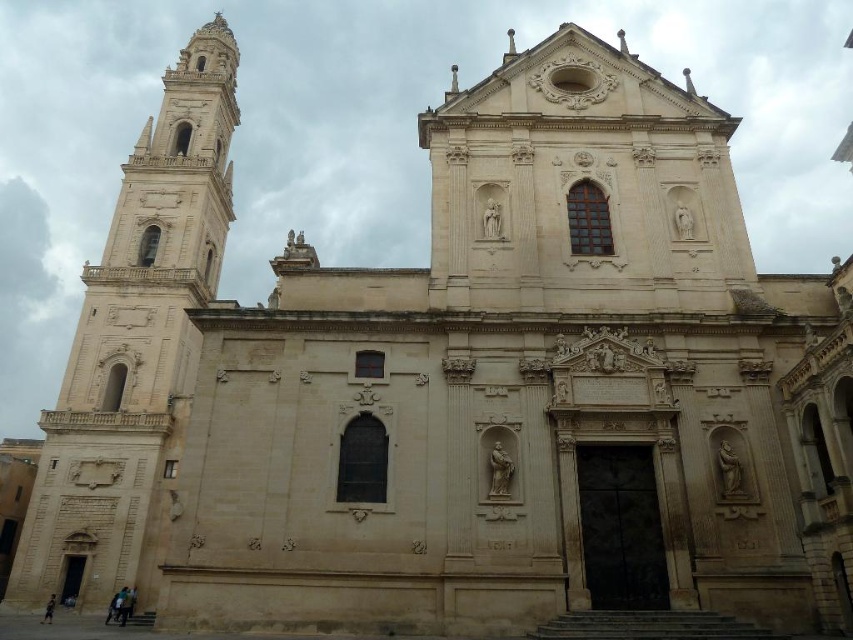
Which is below, smooth beige statue at center or light brown sandal at lower left?

light brown sandal at lower left

Is smooth beige statue at center closer to the viewer compared to light brown sandal at lower left?

Yes, smooth beige statue at center is in front of light brown sandal at lower left.

Between point (490, 490) and point (51, 600), which one is positioned behind?

Point (51, 600)

Identify the location of smooth beige statue at center. (498, 472).

Can you confirm if beige stone tower at left is wider than smooth beige statue at center?

Yes.

Is the position of beige stone tower at left less distant than that of smooth beige statue at center?

No.

Find the location of a particular element. This screenshot has width=853, height=640. beige stone tower at left is located at coordinates (135, 346).

Does beige stone tower at left have a smaller size compared to light brown sandal at lower left?

Incorrect, beige stone tower at left is not smaller in size than light brown sandal at lower left.

Between beige stone tower at left and light brown sandal at lower left, which one appears on the left side from the viewer's perspective?

From the viewer's perspective, light brown sandal at lower left appears more on the left side.

Is point (224, 228) farther from camera compared to point (48, 612)?

Yes, it is.

Identify the location of beige stone tower at left. (135, 346).